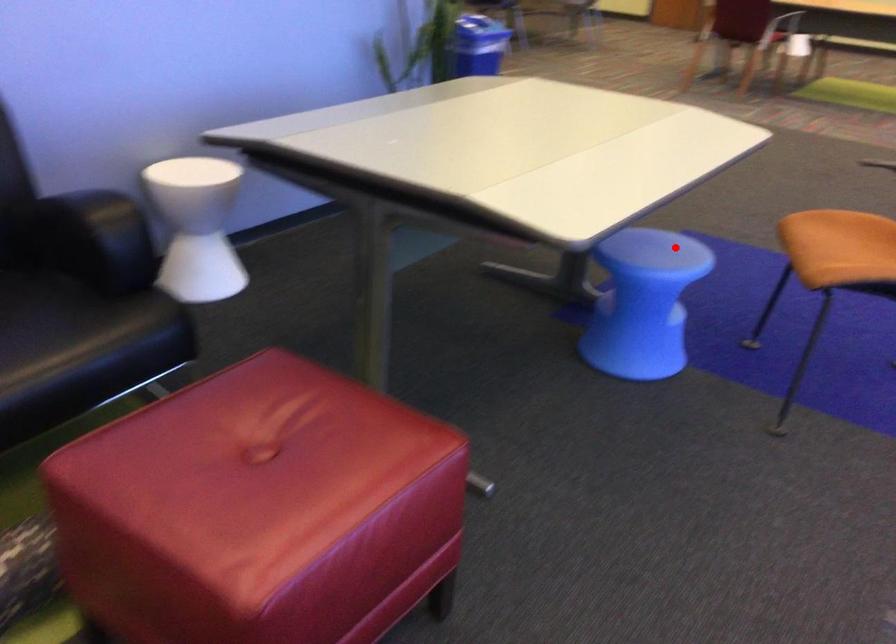
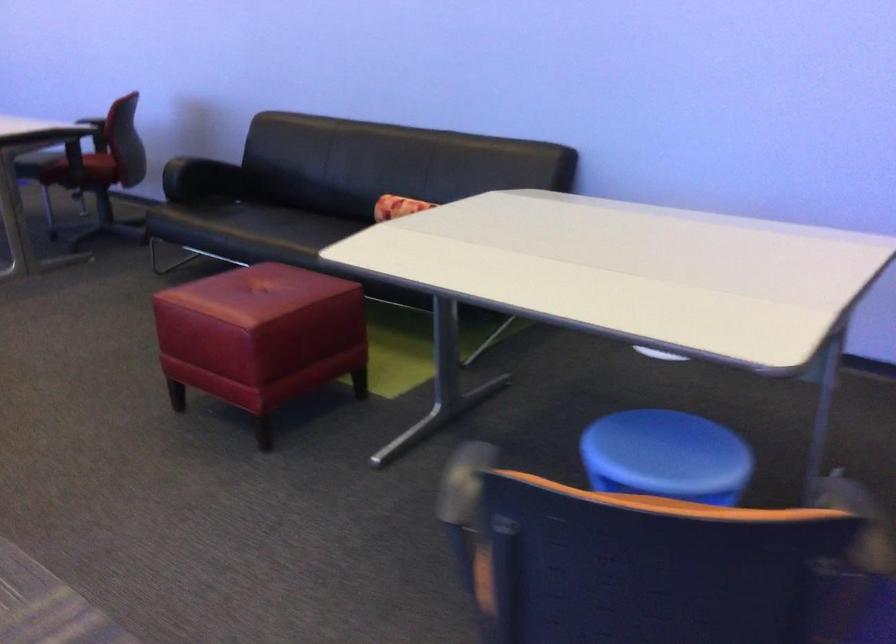
Question: I am providing you with two images of the same scene from different viewpoints. Given a red point in image1, look at the same physical point in image2. Is it:

Choices:
 (A) Closer to the viewpoint
 (B) Farther from the viewpoint

Answer: (A)